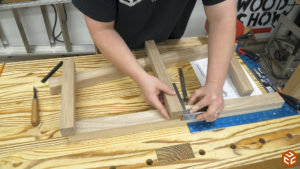
You are a GUI agent. You are given a task and a screenshot of the screen. Output one action in this format:
    pyautogui.click(x=<x>, y=<y>)
    Task: Click on the cables
    
    Given the screenshot: What is the action you would take?
    pyautogui.click(x=54, y=26)